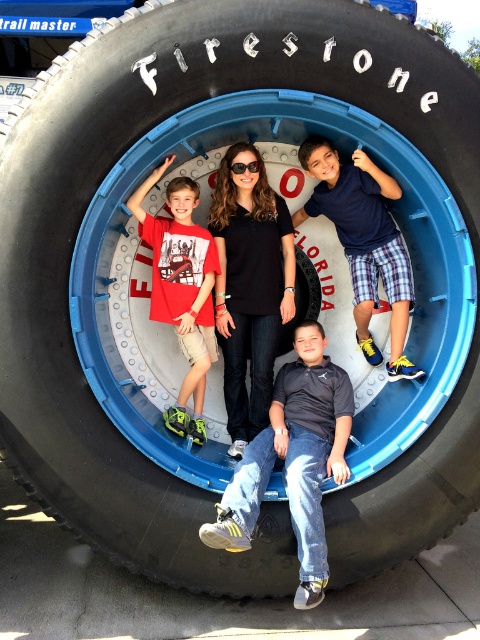
Based on the scene description, where is the dark gray fabric shirt at center located in terms of coordinates?

The dark gray fabric shirt at center is located at coordinates point (294, 460).

You are an event planner organizing a Firestone Florida themed party and need to arrange decorations based on the image. If you want to place a decorative item between the black matte shirt at center and the blue plaid shorts at lower right, where should you place it?

The black matte shirt at center is positioned on the left side of blue plaid shorts at lower right, so placing the decorative item between them would require positioning it to the right of the black matte shirt at center and to the left of the blue plaid shorts at lower right.